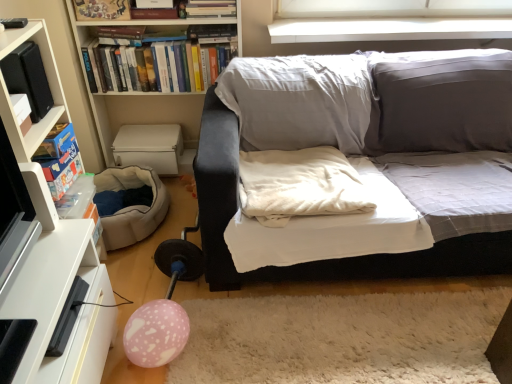
The image size is (512, 384). Find the location of `free region under white fluffy rug at lower center (from a real-world perspective)`. free region under white fluffy rug at lower center (from a real-world perspective) is located at coordinates (364, 349).